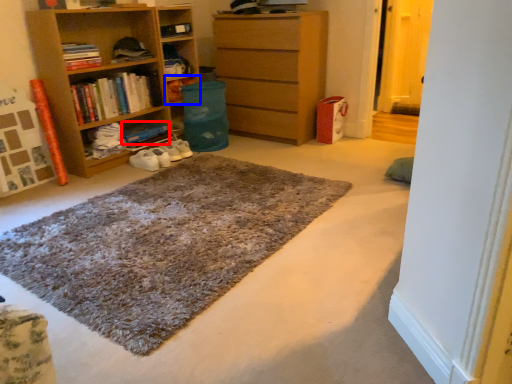
Question: Which of the following is the closest to the observer, book (highlighted by a red box) or shelf (highlighted by a blue box)?

Choices:
 (A) book
 (B) shelf

Answer: (A)